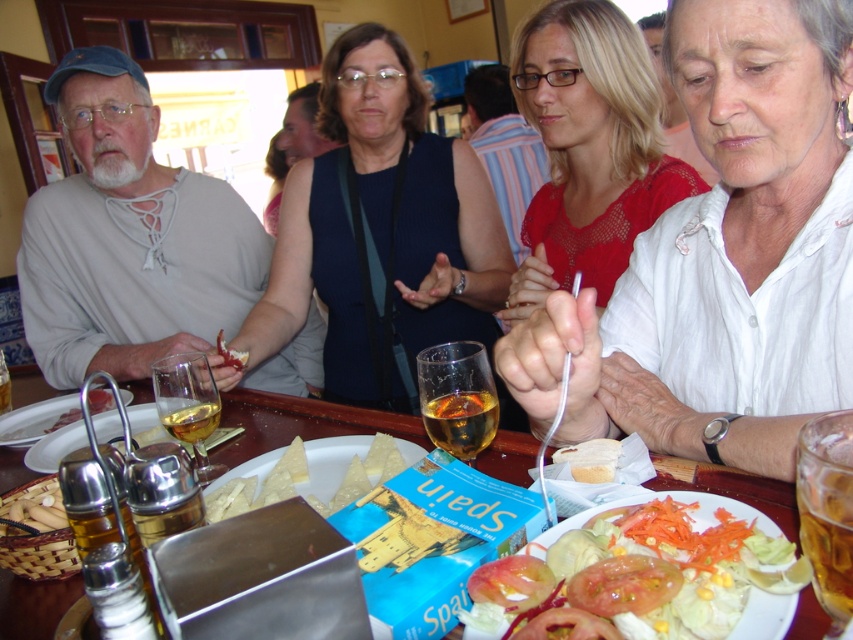
You are sitting at the table in the image and want to reach both the point at coordinates point (329, 474) and the point at coordinates point (225, 349). Which point will your hand reach first if you extend it towards them?

The point at coordinates point (329, 474) will be reached first because it is closer to you than the point at coordinates point (225, 349).

You are a guest at the gathering and want to take a piece of cheese from the table. Which cheese, the yellow crumbly cheese at center or the matte yellow cheese at center, is bigger in size?

The yellow crumbly cheese at center is larger in size than the matte yellow cheese at center, so the yellow crumbly cheese at center is bigger in size.